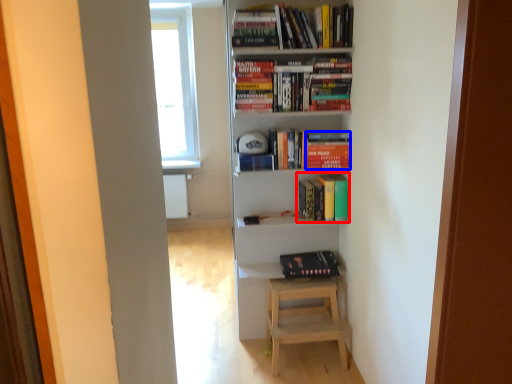
Question: Which of the following is the farthest to the observer, book (highlighted by a red box) or paperback book (highlighted by a blue box)?

Choices:
 (A) book
 (B) paperback book

Answer: (A)